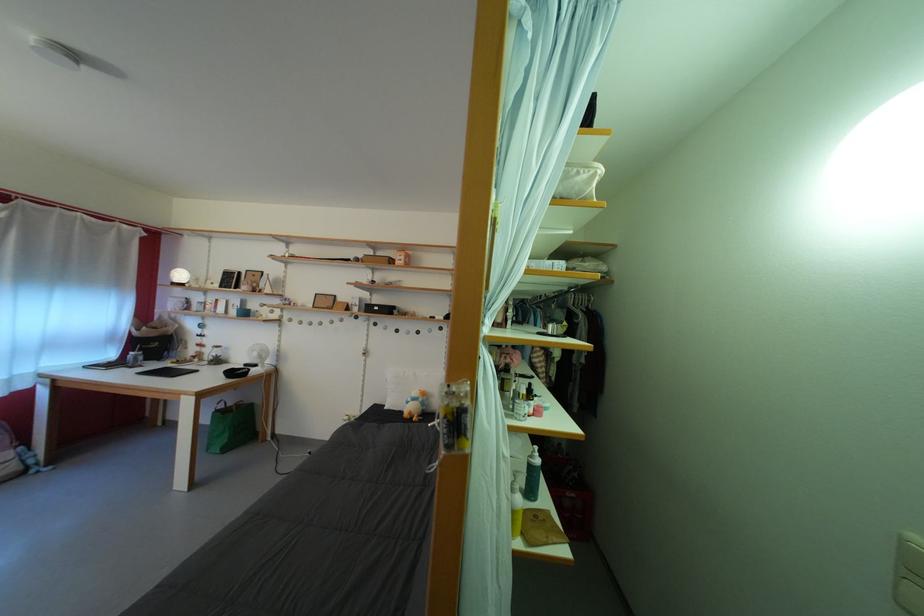
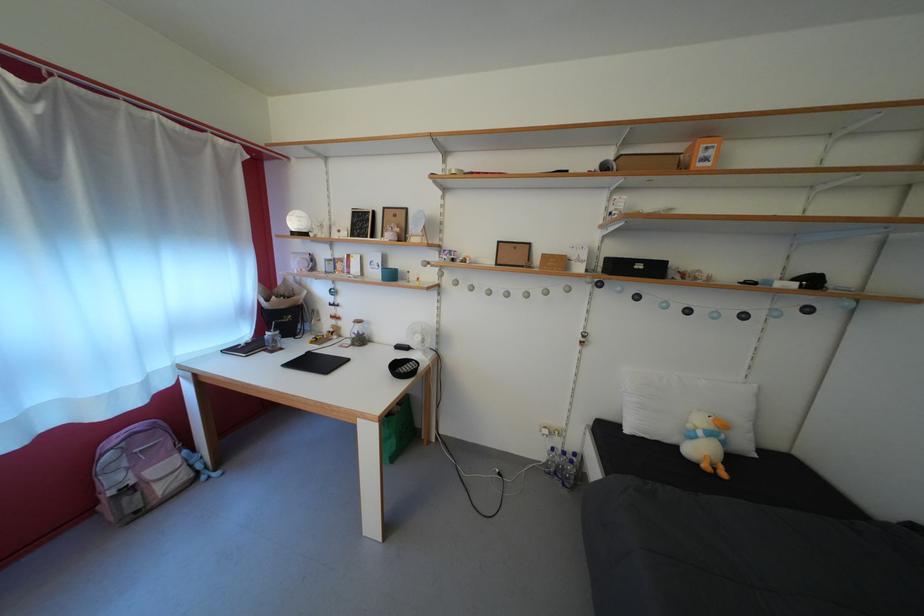
The point at [418,405] is marked in the first image. Where is the corresponding point in the second image?

(709, 439)